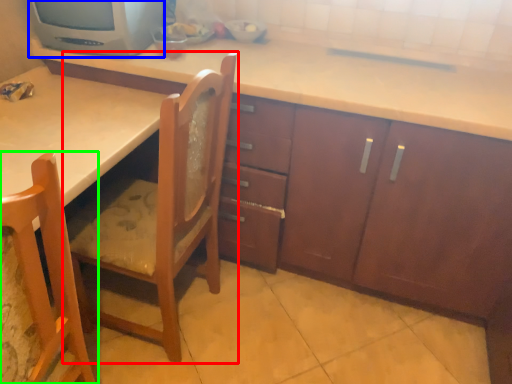
Question: Which object is the closest to the chair (highlighted by a red box)? Choose among these: home appliance (highlighted by a blue box) or chair (highlighted by a green box).

Choices:
 (A) home appliance
 (B) chair

Answer: (B)